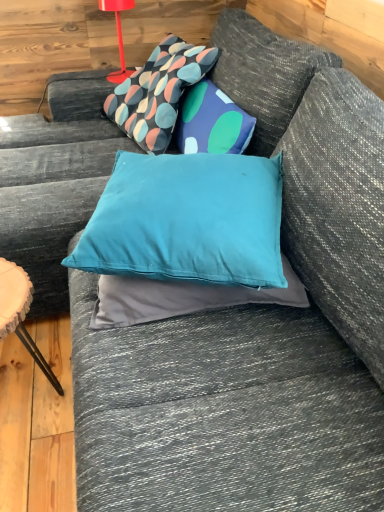
Question: From a real-world perspective, is patterned fabric pillow at upper center, which ranks as the second pillow in front-to-back order, located higher than matte red table lamp at upper left?

Choices:
 (A) no
 (B) yes

Answer: (A)

Question: Is patterned fabric pillow at upper center, which appears as the first pillow when viewed from the top, facing towards matte red table lamp at upper left?

Choices:
 (A) yes
 (B) no

Answer: (B)

Question: Is the position of patterned fabric pillow at upper center, which appears as the first pillow when viewed from the top, more distant than that of matte red table lamp at upper left?

Choices:
 (A) yes
 (B) no

Answer: (B)

Question: From the image's perspective, would you say patterned fabric pillow at upper center, the 2th pillow ordered from the bottom, is shown under matte red table lamp at upper left?

Choices:
 (A) yes
 (B) no

Answer: (A)

Question: Does patterned fabric pillow at upper center, which ranks as the second pillow in front-to-back order, appear on the right side of matte red table lamp at upper left?

Choices:
 (A) yes
 (B) no

Answer: (A)

Question: Relative to wooden side table at lower left, is teal fabric pillow at center, which is the 2th pillow from top to bottom, in front or behind?

Choices:
 (A) behind
 (B) front

Answer: (B)

Question: Would you say teal fabric pillow at center, positioned as the first pillow in front-to-back order, is inside or outside wooden side table at lower left?

Choices:
 (A) outside
 (B) inside

Answer: (A)

Question: Considering the positions of point (145, 161) and point (29, 339), is point (145, 161) closer or farther from the camera than point (29, 339)?

Choices:
 (A) closer
 (B) farther

Answer: (A)

Question: In terms of height, does teal fabric pillow at center, which is the 1th pillow in bottom-to-top order, look taller or shorter compared to wooden side table at lower left?

Choices:
 (A) tall
 (B) short

Answer: (B)

Question: In terms of width, does wooden side table at lower left look wider or thinner when compared to teal fabric pillow at center, positioned as the first pillow in front-to-back order?

Choices:
 (A) wide
 (B) thin

Answer: (B)

Question: Based on their positions, is wooden side table at lower left located to the left or right of teal fabric pillow at center, which is the 2th pillow from top to bottom?

Choices:
 (A) right
 (B) left

Answer: (B)

Question: In terms of size, does wooden side table at lower left appear bigger or smaller than teal fabric pillow at center, which is the second pillow in back-to-front order?

Choices:
 (A) small
 (B) big

Answer: (A)

Question: Is point (23, 289) positioned closer to the camera than point (132, 254)?

Choices:
 (A) farther
 (B) closer

Answer: (A)

Question: Is patterned fabric pillow at upper center, the 2th pillow ordered from the bottom, spatially inside matte red table lamp at upper left, or outside of it?

Choices:
 (A) inside
 (B) outside

Answer: (B)

Question: From the image's perspective, relative to matte red table lamp at upper left, is patterned fabric pillow at upper center, the first pillow positioned from the back, above or below?

Choices:
 (A) below
 (B) above

Answer: (A)